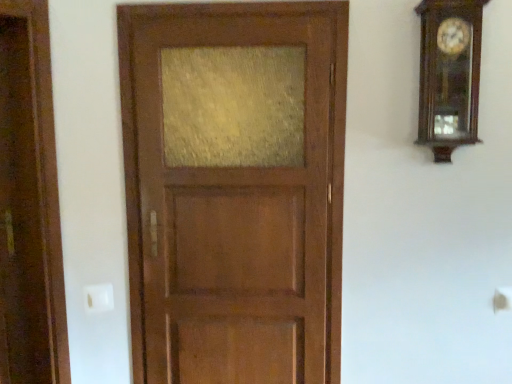
Describe the element at coordinates (234, 189) in the screenshot. I see `satin wood door at center` at that location.

The width and height of the screenshot is (512, 384). Find the location of `satin wood door at center`. satin wood door at center is located at coordinates (234, 189).

What do you see at coordinates (449, 74) in the screenshot?
I see `wooden grandfather clock at upper right` at bounding box center [449, 74].

Identify the location of wooden grandfather clock at upper right. (449, 74).

Locate an element on the screen. This screenshot has height=384, width=512. satin wood door at center is located at coordinates (234, 189).

Can you confirm if satin wood door at center is positioned to the left of wooden grandfather clock at upper right?

Yes, satin wood door at center is to the left of wooden grandfather clock at upper right.

Is the depth of satin wood door at center greater than that of wooden grandfather clock at upper right?

That is True.

Which is more distant, [276,366] or [423,30]?

Point [276,366]

From the image's perspective, is satin wood door at center below wooden grandfather clock at upper right?

Correct, satin wood door at center appears lower than wooden grandfather clock at upper right in the image.

From a real-world perspective, which object stands above the other?

wooden grandfather clock at upper right is physically above.

In terms of width, does satin wood door at center look wider or thinner when compared to wooden grandfather clock at upper right?

Considering their sizes, satin wood door at center looks slimmer than wooden grandfather clock at upper right.

Is satin wood door at center taller or shorter than wooden grandfather clock at upper right?

Clearly, satin wood door at center is taller compared to wooden grandfather clock at upper right.

Looking at this image, does satin wood door at center have a larger size compared to wooden grandfather clock at upper right?

Yes, satin wood door at center is bigger than wooden grandfather clock at upper right.

Based on the photo, is satin wood door at center spatially inside wooden grandfather clock at upper right, or outside of it?

satin wood door at center lies outside wooden grandfather clock at upper right.

Is satin wood door at center next to wooden grandfather clock at upper right and touching it?

There is a gap between satin wood door at center and wooden grandfather clock at upper right.

Is satin wood door at center turned away from wooden grandfather clock at upper right?

No, satin wood door at center's orientation is not away from wooden grandfather clock at upper right.

What are the coordinates of `door below the wooden grandfather clock at upper right (from a real-world perspective)` in the screenshot? It's located at (234, 189).

Does wooden grandfather clock at upper right appear on the right side of satin wood door at center?

Yes, wooden grandfather clock at upper right is to the right of satin wood door at center.

Is wooden grandfather clock at upper right further to camera compared to satin wood door at center?

That is False.

Considering the points (472, 54) and (189, 40), which point is in front, point (472, 54) or point (189, 40)?

Positioned in front is point (472, 54).

From the image's perspective, is wooden grandfather clock at upper right located above or below satin wood door at center?

From the image's perspective, wooden grandfather clock at upper right appears above satin wood door at center.

From a real-world perspective, who is located higher, wooden grandfather clock at upper right or satin wood door at center?

wooden grandfather clock at upper right is physically above.

Looking at their sizes, would you say wooden grandfather clock at upper right is wider or thinner than satin wood door at center?

Considering their sizes, wooden grandfather clock at upper right looks broader than satin wood door at center.

Which of these two, wooden grandfather clock at upper right or satin wood door at center, stands shorter?

wooden grandfather clock at upper right.

Can you confirm if wooden grandfather clock at upper right is smaller than satin wood door at center?

Yes.

Would you say wooden grandfather clock at upper right is inside or outside satin wood door at center?

The correct answer is: outside.

Is wooden grandfather clock at upper right touching satin wood door at center?

No, wooden grandfather clock at upper right is not touching satin wood door at center.

Is wooden grandfather clock at upper right facing away from satin wood door at center?

That's not correct — wooden grandfather clock at upper right is not looking away from satin wood door at center.

In the image, there is a wooden grandfather clock at upper right. Where is `door below it (from the image's perspective)`? door below it (from the image's perspective) is located at coordinates (234, 189).

What are the coordinates of `door behind the wooden grandfather clock at upper right` in the screenshot? It's located at (234, 189).

The height and width of the screenshot is (384, 512). What are the coordinates of `clock above the satin wood door at center (from the image's perspective)` in the screenshot? It's located at (449, 74).